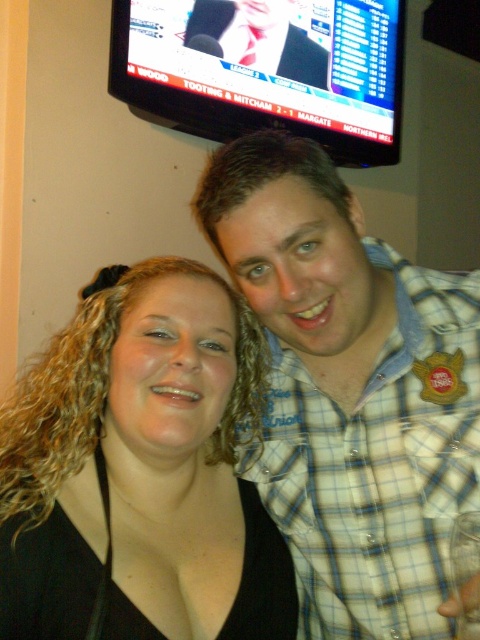
Does black matte hair at center have a lesser width compared to matte black tie at upper center?

Correct, black matte hair at center's width is less than matte black tie at upper center's.

Who is more distant from viewer, [56,403] or [210,52]?

The point [210,52] is behind.

Measure the distance between black matte hair at center and camera.

23.75 inches

This screenshot has width=480, height=640. Find the location of `black matte hair at center`. black matte hair at center is located at coordinates (141, 472).

Who is more distant from viewer, [325,509] or [284,68]?

Point [284,68]

Image resolution: width=480 pixels, height=640 pixels. What do you see at coordinates (350, 390) in the screenshot?
I see `blue plaid shirt at center` at bounding box center [350, 390].

You are a GUI agent. You are given a task and a screenshot of the screen. Output one action in this format:
    pyautogui.click(x=<x>, y=<y>)
    Task: Click on the blue plaid shirt at center
    The height and width of the screenshot is (640, 480).
    Given the screenshot: What is the action you would take?
    pyautogui.click(x=350, y=390)

In the scene shown: Does blue plaid shirt at center have a greater height compared to black matte hair at center?

Indeed, blue plaid shirt at center has a greater height compared to black matte hair at center.

Is point (287, 352) more distant than point (24, 554)?

Yes.

Who is more distant from viewer, (x=267, y=136) or (x=260, y=556)?

Point (x=260, y=556)

The image size is (480, 640). Identify the location of blue plaid shirt at center. (350, 390).